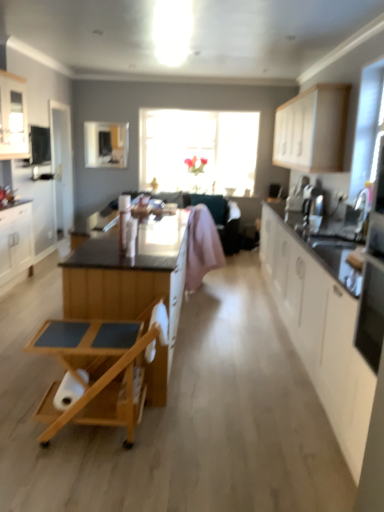
What do you see at coordinates (100, 370) in the screenshot? This screenshot has width=384, height=512. I see `wooden rolling cart at center` at bounding box center [100, 370].

Describe the element at coordinates (320, 333) in the screenshot. The width and height of the screenshot is (384, 512). I see `white matte cabinet at right, which is the 4th cabinetry in left-to-right order` at that location.

Measure the distance between point (x=185, y=213) and camera.

Point (x=185, y=213) and camera are 13.86 feet apart from each other.

At what (x,y) coordinates should I click in order to perform the action: click on wooden cart at center, the third cabinetry when ordered from left to right. Please return your answer as a coordinate pair (x, y). Looking at the image, I should click on 131,286.

The image size is (384, 512). What do you see at coordinates (13, 117) in the screenshot? I see `white glossy cabinet at upper left, which is counted as the second cabinetry, starting from the left` at bounding box center [13, 117].

Where is `pink fabric armchair at center`? The width and height of the screenshot is (384, 512). pink fabric armchair at center is located at coordinates [x=221, y=218].

Locate an element on the screen. This screenshot has height=512, width=384. wooden rolling cart at center is located at coordinates (100, 370).

Does white glossy cabinet at upper left, the 4th cabinetry in the right-to-left sequence, have a lesser height compared to pink fabric armchair at center?

Yes, white glossy cabinet at upper left, the 4th cabinetry in the right-to-left sequence, is shorter than pink fabric armchair at center.

Is point (19, 93) farther from viewer compared to point (209, 207)?

No, it is in front of (209, 207).

Is white glossy cabinet at upper left, which is counted as the second cabinetry, starting from the left, looking in the opposite direction of pink fabric armchair at center?

No, pink fabric armchair at center is not at the back of white glossy cabinet at upper left, which is counted as the second cabinetry, starting from the left.

The height and width of the screenshot is (512, 384). Find the location of `the 2nd cabinetry counting from the left of the pink fabric armchair at center`. the 2nd cabinetry counting from the left of the pink fabric armchair at center is located at coordinates (13, 117).

Looking at the image, does white glossy cabinet at left, the 5th cabinetry in the right-to-left sequence, seem bigger or smaller compared to white matte cabinet at upper right, the 5th cabinetry positioned from the left?

white glossy cabinet at left, the 5th cabinetry in the right-to-left sequence, is smaller than white matte cabinet at upper right, the 5th cabinetry positioned from the left.

Would you say white glossy cabinet at left, marked as the 1th cabinetry in a left-to-right arrangement, is inside or outside white matte cabinet at upper right, the 5th cabinetry positioned from the left?

white glossy cabinet at left, marked as the 1th cabinetry in a left-to-right arrangement, is located beyond the bounds of white matte cabinet at upper right, the 5th cabinetry positioned from the left.

Consider the image. From a real-world perspective, is white glossy cabinet at left, marked as the 1th cabinetry in a left-to-right arrangement, positioned above or below white matte cabinet at upper right, placed as the first cabinetry when sorted from right to left?

In terms of real-world spatial position, white glossy cabinet at left, marked as the 1th cabinetry in a left-to-right arrangement, is below white matte cabinet at upper right, placed as the first cabinetry when sorted from right to left.

Based on the photo, is white glossy cabinet at left, marked as the 1th cabinetry in a left-to-right arrangement, looking in the opposite direction of white matte cabinet at upper right, placed as the first cabinetry when sorted from right to left?

That's not correct — white glossy cabinet at left, marked as the 1th cabinetry in a left-to-right arrangement, is not looking away from white matte cabinet at upper right, placed as the first cabinetry when sorted from right to left.

Considering the sizes of white glossy cabinet at upper left, which is counted as the second cabinetry, starting from the left, and wooden cart at center, the third cabinetry when ordered from left to right, in the image, is white glossy cabinet at upper left, which is counted as the second cabinetry, starting from the left, wider or thinner than wooden cart at center, the third cabinetry when ordered from left to right,?

Considering their sizes, white glossy cabinet at upper left, which is counted as the second cabinetry, starting from the left, looks slimmer than wooden cart at center, the third cabinetry when ordered from left to right.

In the image, is white glossy cabinet at upper left, the 4th cabinetry in the right-to-left sequence, on the left side or the right side of wooden cart at center, the third cabinetry when ordered from left to right?

Clearly, white glossy cabinet at upper left, the 4th cabinetry in the right-to-left sequence, is on the left of wooden cart at center, the third cabinetry when ordered from left to right, in the image.

Is white glossy cabinet at upper left, which is counted as the second cabinetry, starting from the left, shorter than wooden cart at center, the third cabinetry when ordered from left to right?

Correct, white glossy cabinet at upper left, which is counted as the second cabinetry, starting from the left, is not as tall as wooden cart at center, the third cabinetry when ordered from left to right.

From a real-world perspective, is white glossy cabinet at upper left, the 4th cabinetry in the right-to-left sequence, located beneath wooden cart at center, arranged as the third cabinetry when viewed from the right?

No, from a real-world perspective, white glossy cabinet at upper left, the 4th cabinetry in the right-to-left sequence, is not under wooden cart at center, arranged as the third cabinetry when viewed from the right.

Is wooden rolling cart at center aimed at wooden cart at center, the third cabinetry when ordered from left to right?

No, wooden rolling cart at center does not turn towards wooden cart at center, the third cabinetry when ordered from left to right.

From a real-world perspective, is wooden rolling cart at center positioned under wooden cart at center, arranged as the third cabinetry when viewed from the right, based on gravity?

Yes.

How many degrees apart are the facing directions of wooden rolling cart at center and wooden cart at center, the third cabinetry when ordered from left to right?

The angle between the facing direction of wooden rolling cart at center and the facing direction of wooden cart at center, the third cabinetry when ordered from left to right, is 88.2 degrees.

Looking at this image, is wooden rolling cart at center not close to wooden cart at center, the third cabinetry when ordered from left to right?

wooden rolling cart at center is actually quite close to wooden cart at center, the third cabinetry when ordered from left to right.

Can you tell me how much white glossy cabinet at upper left, the 4th cabinetry in the right-to-left sequence, and white matte cabinet at upper right, placed as the first cabinetry when sorted from right to left, differ in facing direction?

179 degrees separate the facing orientations of white glossy cabinet at upper left, the 4th cabinetry in the right-to-left sequence, and white matte cabinet at upper right, placed as the first cabinetry when sorted from right to left.

Is white glossy cabinet at upper left, the 4th cabinetry in the right-to-left sequence, thinner than white matte cabinet at upper right, placed as the first cabinetry when sorted from right to left?

Yes.

Is white glossy cabinet at upper left, which is counted as the second cabinetry, starting from the left, with white matte cabinet at upper right, the 5th cabinetry positioned from the left?

white glossy cabinet at upper left, which is counted as the second cabinetry, starting from the left, and white matte cabinet at upper right, the 5th cabinetry positioned from the left, are not in contact.

From a real-world perspective, which is physically below, white glossy cabinet at upper left, which is counted as the second cabinetry, starting from the left, or white matte cabinet at upper right, the 5th cabinetry positioned from the left?

From a 3D spatial view, white matte cabinet at upper right, the 5th cabinetry positioned from the left, is below.

From a real-world perspective, who is located higher, white matte cabinet at upper right, placed as the first cabinetry when sorted from right to left, or transparent glass window at center?

white matte cabinet at upper right, placed as the first cabinetry when sorted from right to left.

Looking at the image, does white matte cabinet at upper right, placed as the first cabinetry when sorted from right to left, seem bigger or smaller compared to transparent glass window at center?

Considering their sizes, white matte cabinet at upper right, placed as the first cabinetry when sorted from right to left, takes up less space than transparent glass window at center.

From a real-world perspective, which cabinetry is the 1st one above the transparent glass window at center? Please provide its 2D coordinates.

[(312, 129)]

Would you say white glossy cabinet at left, marked as the 1th cabinetry in a left-to-right arrangement, is to the left or to the right of wooden rolling cart at center in the picture?

Based on their positions, white glossy cabinet at left, marked as the 1th cabinetry in a left-to-right arrangement, is located to the left of wooden rolling cart at center.

Which of these two, white glossy cabinet at left, marked as the 1th cabinetry in a left-to-right arrangement, or wooden rolling cart at center, stands shorter?

Standing shorter between the two is wooden rolling cart at center.

From the image's perspective, between white glossy cabinet at left, the 5th cabinetry in the right-to-left sequence, and wooden rolling cart at center, which one is located above?

white glossy cabinet at left, the 5th cabinetry in the right-to-left sequence, appears higher in the image.

Where is `the 3rd cabinetry in front of the pink fabric armchair at center`? the 3rd cabinetry in front of the pink fabric armchair at center is located at coordinates (13, 117).

The image size is (384, 512). I want to click on the 2nd cabinetry below the white matte cabinet at upper right, placed as the first cabinetry when sorted from right to left (from the image's perspective), so click(16, 240).

When comparing their distances from pink fabric armchair at center, does white matte cabinet at upper right, the 5th cabinetry positioned from the left, or transparent glass window at center seem further?

white matte cabinet at upper right, the 5th cabinetry positioned from the left.

Looking at the image, which one is located further to white glossy cabinet at left, marked as the 1th cabinetry in a left-to-right arrangement, transparent glass window at center or white matte cabinet at right, which is the 4th cabinetry in left-to-right order?

The object further to white glossy cabinet at left, marked as the 1th cabinetry in a left-to-right arrangement, is transparent glass window at center.

Consider the image. When comparing their distances from wooden cart at center, the third cabinetry when ordered from left to right, does white matte cabinet at upper right, the 5th cabinetry positioned from the left, or wooden rolling cart at center seem further?

The object further to wooden cart at center, the third cabinetry when ordered from left to right, is white matte cabinet at upper right, the 5th cabinetry positioned from the left.

Based on their spatial positions, is wooden rolling cart at center or white glossy cabinet at upper left, the 4th cabinetry in the right-to-left sequence, further from transparent glass window at center?

wooden rolling cart at center lies further to transparent glass window at center than the other object.

From the image, which object appears to be nearer to pink fabric armchair at center, white matte cabinet at upper right, placed as the first cabinetry when sorted from right to left, or white matte cabinet at right, which is the 4th cabinetry in left-to-right order?

white matte cabinet at upper right, placed as the first cabinetry when sorted from right to left, lies closer to pink fabric armchair at center than the other object.

From the image, which object appears to be nearer to white matte cabinet at upper right, placed as the first cabinetry when sorted from right to left, wooden cart at center, the third cabinetry when ordered from left to right, or white matte cabinet at right, the 2th cabinetry positioned from the right?

Based on the image, white matte cabinet at right, the 2th cabinetry positioned from the right, appears to be nearer to white matte cabinet at upper right, placed as the first cabinetry when sorted from right to left.

Looking at the image, which one is located further to white matte cabinet at right, the 2th cabinetry positioned from the right, wooden cart at center, the third cabinetry when ordered from left to right, or white glossy cabinet at upper left, the 4th cabinetry in the right-to-left sequence?

white glossy cabinet at upper left, the 4th cabinetry in the right-to-left sequence, is further to white matte cabinet at right, the 2th cabinetry positioned from the right.

Based on their spatial positions, is wooden cart at center, the third cabinetry when ordered from left to right, or transparent glass window at center closer to white matte cabinet at right, which is the 4th cabinetry in left-to-right order?

wooden cart at center, the third cabinetry when ordered from left to right, is positioned closer to the anchor white matte cabinet at right, which is the 4th cabinetry in left-to-right order.

Find the location of a particular element. Image resolution: width=384 pixels, height=512 pixels. table between white glossy cabinet at upper left, the 4th cabinetry in the right-to-left sequence, and white matte cabinet at upper right, placed as the first cabinetry when sorted from right to left, from left to right is located at coordinates (100, 370).

The height and width of the screenshot is (512, 384). What are the coordinates of `armchair situated between white glossy cabinet at left, the 5th cabinetry in the right-to-left sequence, and white matte cabinet at right, the 2th cabinetry positioned from the right, from left to right` in the screenshot? It's located at (221, 218).

Locate an element on the screen. This screenshot has height=512, width=384. table situated between white glossy cabinet at left, marked as the 1th cabinetry in a left-to-right arrangement, and white matte cabinet at right, which is the 4th cabinetry in left-to-right order, from left to right is located at coordinates [x=100, y=370].

You are a GUI agent. You are given a task and a screenshot of the screen. Output one action in this format:
    pyautogui.click(x=<x>, y=<y>)
    Task: Click on the cabinetry between wooden cart at center, the third cabinetry when ordered from left to right, and white glossy cabinet at left, the 5th cabinetry in the right-to-left sequence, from front to back
    The height and width of the screenshot is (512, 384).
    Given the screenshot: What is the action you would take?
    pyautogui.click(x=13, y=117)